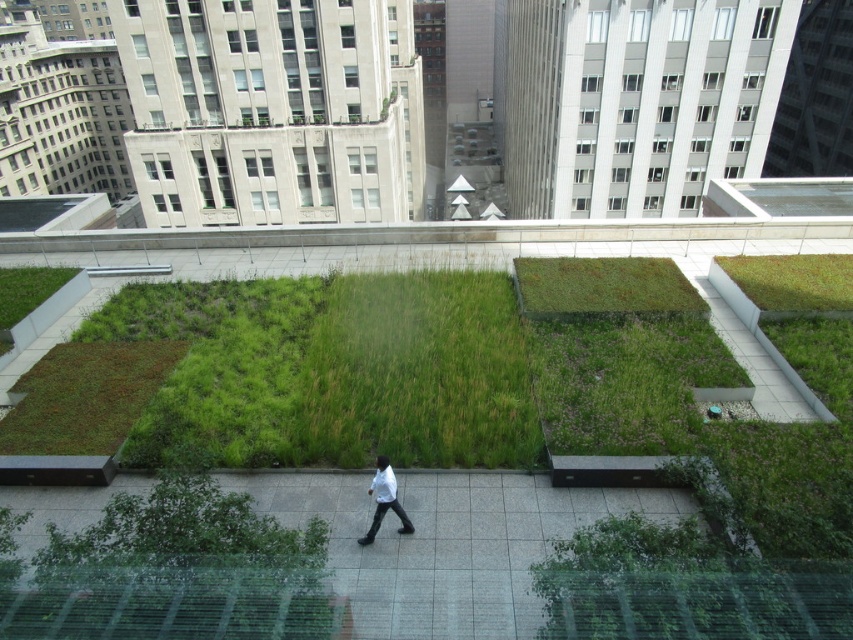
Does point (791, 269) come behind point (381, 492)?

Yes, it is.

Does green grass at upper right have a greater width compared to white matte shirt at center?

Yes.

What do you see at coordinates (792, 280) in the screenshot? I see `green grass at upper right` at bounding box center [792, 280].

Where is `green grass at upper right`? The height and width of the screenshot is (640, 853). green grass at upper right is located at coordinates (792, 280).

Between point (548, 272) and point (389, 481), which one is positioned behind?

Positioned behind is point (548, 272).

Does green mossy patch at center-right have a larger size compared to white matte shirt at center?

Yes.

Does point (540, 312) come in front of point (403, 528)?

No, (540, 312) is behind (403, 528).

Locate an element on the screen. The width and height of the screenshot is (853, 640). green mossy patch at center-right is located at coordinates (602, 288).

In the scene shown: Between green mossy patch at center-right and green grass at upper right, which one has more height?

With more height is green mossy patch at center-right.

Is green mossy patch at center-right bigger than green grass at upper right?

Correct, green mossy patch at center-right is larger in size than green grass at upper right.

Does point (635, 292) lie behind point (815, 262)?

That is False.

At what (x,y) coordinates should I click in order to perform the action: click on green mossy patch at center-right. Please return your answer as a coordinate pair (x, y). The height and width of the screenshot is (640, 853). Looking at the image, I should click on (602, 288).